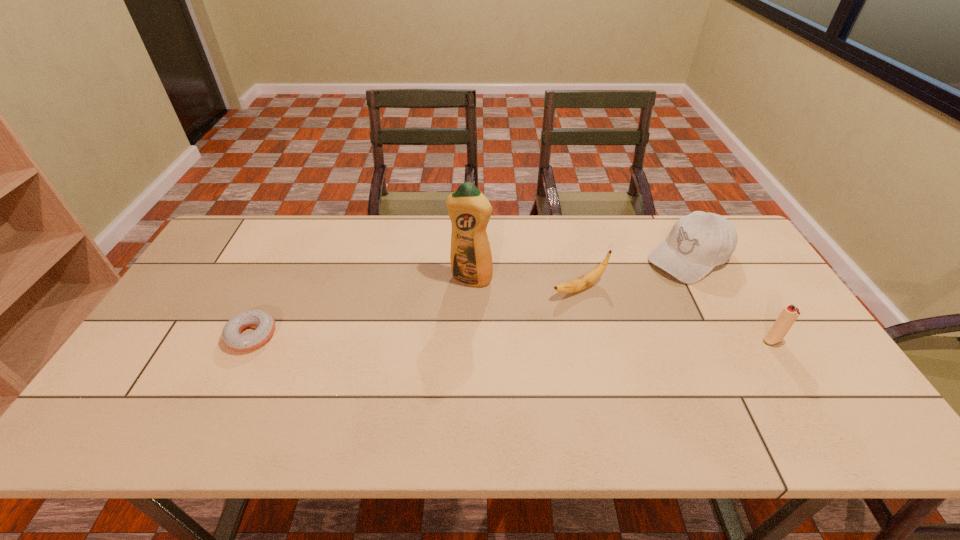
The image size is (960, 540). What are the coordinates of `the leftmost object` in the screenshot? It's located at (231, 334).

Find the location of `doughnut`. doughnut is located at coordinates (231, 334).

The width and height of the screenshot is (960, 540). What are the coordinates of `igniter` in the screenshot? It's located at (790, 313).

What are the coordinates of `the fourth object from right to left` in the screenshot? It's located at (469, 210).

Find the location of a particular element. The image size is (960, 540). detergent is located at coordinates (469, 210).

Image resolution: width=960 pixels, height=540 pixels. What are the coordinates of `the third object from right to left` in the screenshot? It's located at (588, 279).

Where is `the second shortest object`? The image size is (960, 540). the second shortest object is located at coordinates (588, 279).

Locate an element on the screen. The image size is (960, 540). baseball cap is located at coordinates (698, 242).

At what (x,y) coordinates should I click in order to perform the action: click on blank area located on the right of the leftmost object. Please return your answer as a coordinate pair (x, y). The image size is (960, 540). Looking at the image, I should click on (367, 335).

At what (x,y) coordinates should I click in order to perform the action: click on free space located on the back of the igniter. Please return your answer as a coordinate pair (x, y). Looking at the image, I should click on (746, 298).